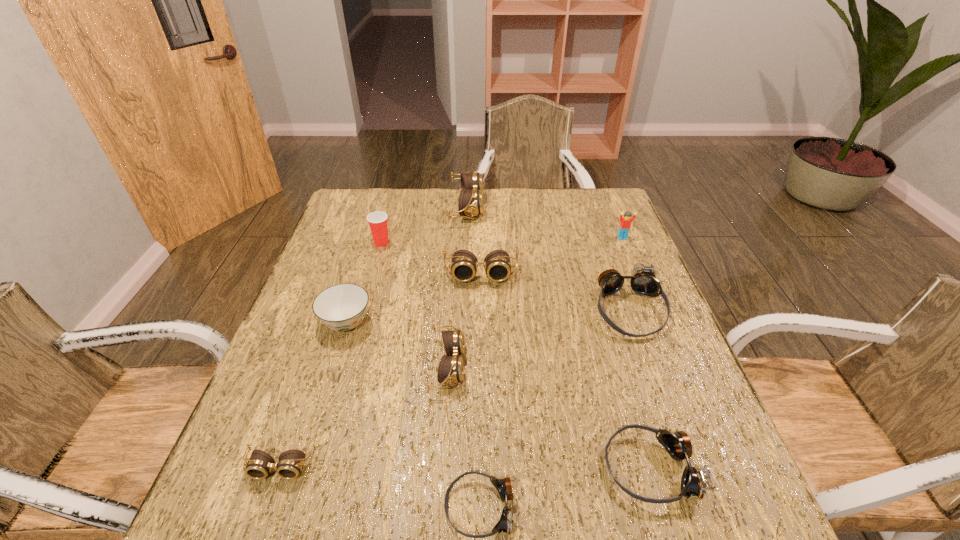
Image resolution: width=960 pixels, height=540 pixels. I want to click on the tallest goggles, so click(x=470, y=203).

Image resolution: width=960 pixels, height=540 pixels. Identify the location of the farthest object. (470, 203).

I want to click on red Lego, so click(625, 224).

This screenshot has height=540, width=960. Identify the location of red Dixie cup. (377, 220).

Image resolution: width=960 pixels, height=540 pixels. In order to click on the third smallest brown goggles in this screenshot , I will do `click(464, 264)`.

This screenshot has height=540, width=960. I want to click on the biggest bronze goggles, so click(x=643, y=281).

You are a GUI agent. You are given a task and a screenshot of the screen. Output one action in this format:
    pyautogui.click(x=<x>, y=<y>)
    Task: Click on the soup bowl
    The width and height of the screenshot is (960, 540).
    Given the screenshot: What is the action you would take?
    pyautogui.click(x=342, y=307)

What are the coordinates of `the second nearest brown goggles` in the screenshot? It's located at (450, 370).

Where is `the second smallest bronze goggles`? The height and width of the screenshot is (540, 960). the second smallest bronze goggles is located at coordinates (693, 483).

I want to click on the smallest brown goggles, so click(258, 467).